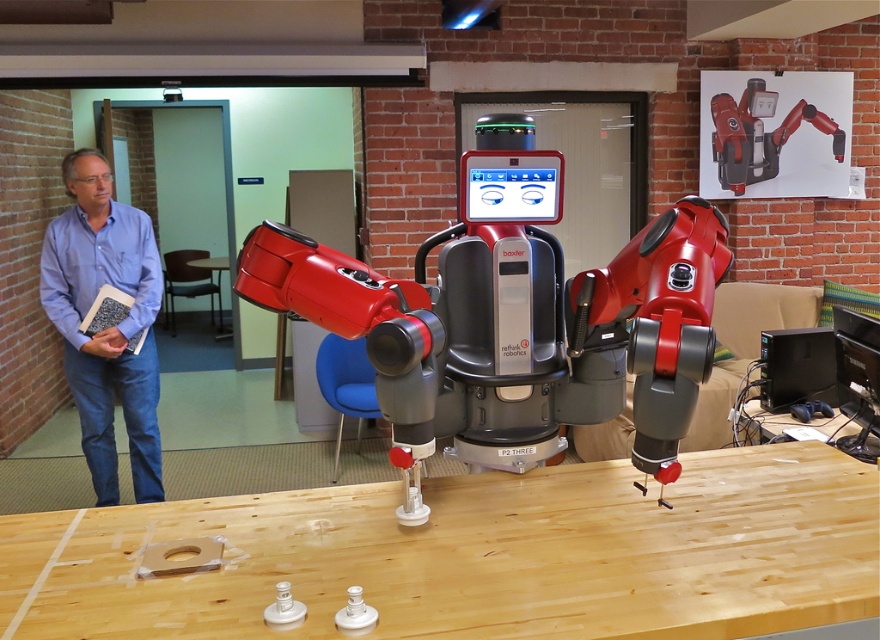
You are a technician standing 1 meter away from the wooden table at center. You need to reach the metallic red robot at center to perform maintenance. Can you reach it without moving closer to the robot?

The metallic red robot at center is 6.17 meters from the wooden table at center. Since you are already 1 meter away from the wooden table, the total distance between you and the robot is 6.17 meters. This distance is too large to reach the robot without moving closer.

You are a delivery person who needs to place a large package on the wooden table at center. You have a blue plastic chair at center in the way. Can you move the chair to make space? Explain your reasoning.

The blue plastic chair at center is 3.54 meters away from the wooden table at center. Since the chair is far from the table, you can easily move it closer or reposition it to make space for the large package on the wooden table at center.

You are a delivery person who needs to place a large box on the table. The box is wider than the blue plastic chair at center. Can the box fit on the wooden table at center?

The blue plastic chair at center is narrower than the wooden table at center. Since the box is wider than the chair, it might still fit on the table if the table is wide enough. However, without knowing the exact dimensions of the box and table, it is uncertain. The answer should reference the given information that the table is wider than the chair, so if the box is only wider than the chair but not exceeding the table width, it could fit.